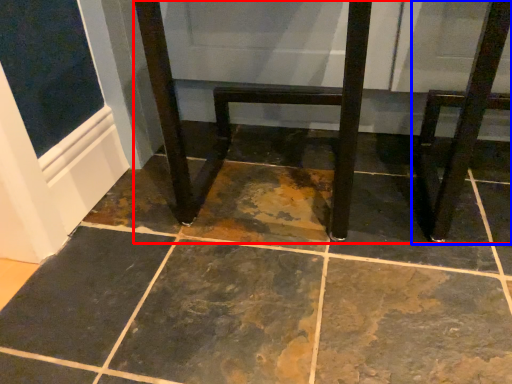
Question: Which object appears closest to the camera in this image, furniture (highlighted by a red box) or step stool (highlighted by a blue box)?

Choices:
 (A) furniture
 (B) step stool

Answer: (B)